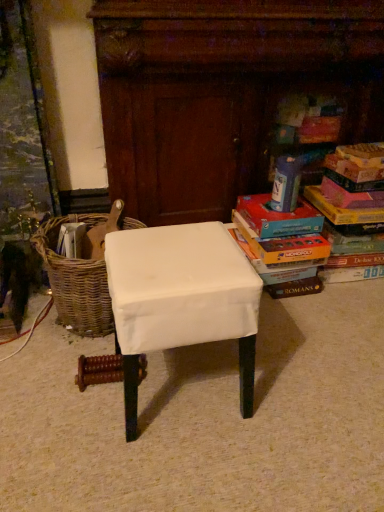
Question: In terms of height, does hardcover book at upper right look taller or shorter compared to woven brown basket at left?

Choices:
 (A) tall
 (B) short

Answer: (B)

Question: Is hardcover book at upper right inside the boundaries of woven brown basket at left, or outside?

Choices:
 (A) inside
 (B) outside

Answer: (B)

Question: Estimate the real-world distances between objects in this image. Which object is closer to the multicolored cardboard books at right, the 1th book viewed from the right?

Choices:
 (A) hardcover book at upper right
 (B) matte cardboard book at right, the first book positioned from the left
 (C) woven brown basket at left
 (D) white fabric-covered stool at center

Answer: (B)

Question: Which object is the closest to the white fabric-covered stool at center?

Choices:
 (A) multicolored cardboard books at right, which ranks as the 2th book in left-to-right order
 (B) hardcover book at upper right
 (C) woven brown basket at left
 (D) matte cardboard book at right, the first book positioned from the left

Answer: (C)